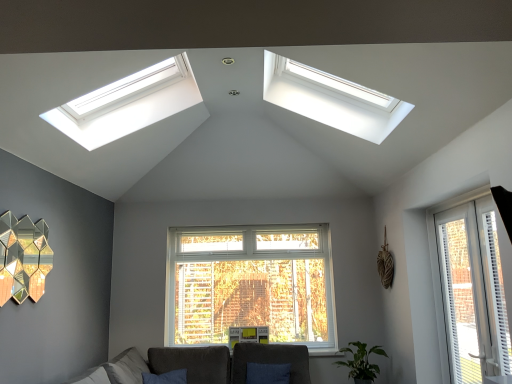
Question: Is dark gray fabric couch at lower center further to camera compared to white plastic window at right, arranged as the second window when viewed from the top?

Choices:
 (A) yes
 (B) no

Answer: (A)

Question: Considering the relative sizes of dark gray fabric couch at lower center and white plastic window at right, arranged as the second window when viewed from the top, in the image provided, is dark gray fabric couch at lower center bigger than white plastic window at right, arranged as the second window when viewed from the top,?

Choices:
 (A) no
 (B) yes

Answer: (B)

Question: Does dark gray fabric couch at lower center have a lesser width compared to white plastic window at right, arranged as the second window when viewed from the top?

Choices:
 (A) yes
 (B) no

Answer: (B)

Question: Can you confirm if dark gray fabric couch at lower center is smaller than white plastic window at right, arranged as the second window when viewed from the top?

Choices:
 (A) yes
 (B) no

Answer: (B)

Question: Can you confirm if dark gray fabric couch at lower center is shorter than white plastic window at right, marked as the 2th window in a left-to-right arrangement?

Choices:
 (A) no
 (B) yes

Answer: (B)

Question: Considering the positions of point (42, 230) and point (295, 372), is point (42, 230) closer or farther from the camera than point (295, 372)?

Choices:
 (A) closer
 (B) farther

Answer: (A)

Question: From the image's perspective, relative to velvet dark gray armchair at center, is gold hexagonal mirror at left above or below?

Choices:
 (A) below
 (B) above

Answer: (B)

Question: Is gold hexagonal mirror at left situated inside velvet dark gray armchair at center or outside?

Choices:
 (A) inside
 (B) outside

Answer: (B)

Question: Is gold hexagonal mirror at left taller or shorter than velvet dark gray armchair at center?

Choices:
 (A) tall
 (B) short

Answer: (A)

Question: Would you say velvet dark gray armchair at center is inside or outside dark gray fabric couch at lower center?

Choices:
 (A) inside
 (B) outside

Answer: (A)

Question: From the image's perspective, is velvet dark gray armchair at center positioned above or below dark gray fabric couch at lower center?

Choices:
 (A) below
 (B) above

Answer: (B)

Question: Relative to dark gray fabric couch at lower center, is velvet dark gray armchair at center in front or behind?

Choices:
 (A) front
 (B) behind

Answer: (B)

Question: Is velvet dark gray armchair at center bigger or smaller than dark gray fabric couch at lower center?

Choices:
 (A) small
 (B) big

Answer: (A)

Question: Is point (493, 306) closer or farther from the camera than point (184, 347)?

Choices:
 (A) closer
 (B) farther

Answer: (A)

Question: From their relative heights in the image, would you say white plastic window at right, which is the 1th window from right to left, is taller or shorter than dark gray fabric couch at lower center?

Choices:
 (A) tall
 (B) short

Answer: (A)